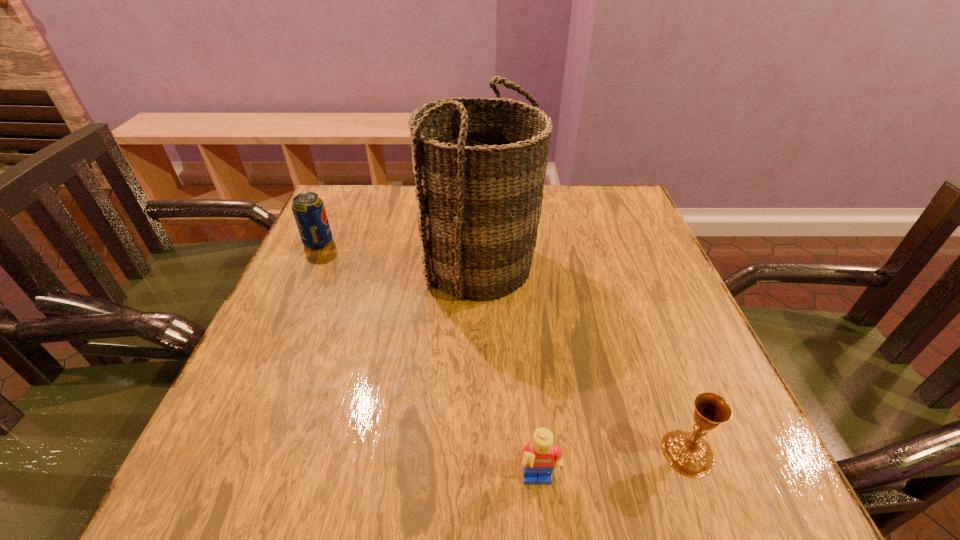
You are a GUI agent. You are given a task and a screenshot of the screen. Output one action in this format:
    pyautogui.click(x=<x>, y=<y>)
    Task: Click on the object that is the closest to the chalice
    This screenshot has width=960, height=540.
    Given the screenshot: What is the action you would take?
    pyautogui.click(x=539, y=458)

Locate an element on the screen. The height and width of the screenshot is (540, 960). vacant region that satisfies the following two spatial constraints: 1. on the front side of the rightmost object; 2. on the left side of the leftmost object is located at coordinates (221, 453).